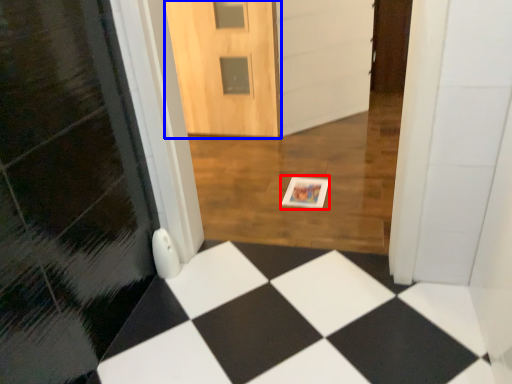
Question: Which object is closer to the camera taking this photo, postcard (highlighted by a red box) or door (highlighted by a blue box)?

Choices:
 (A) postcard
 (B) door

Answer: (A)